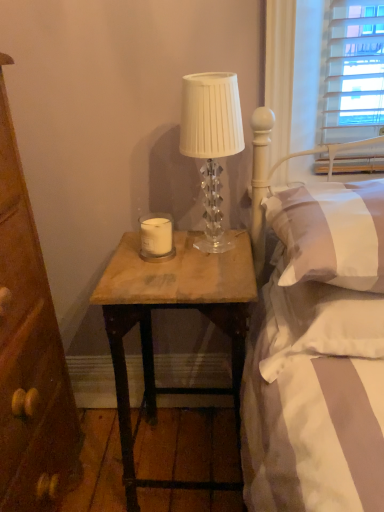
Identify the location of free point in front of white matte candle at center. This screenshot has width=384, height=512. (165, 272).